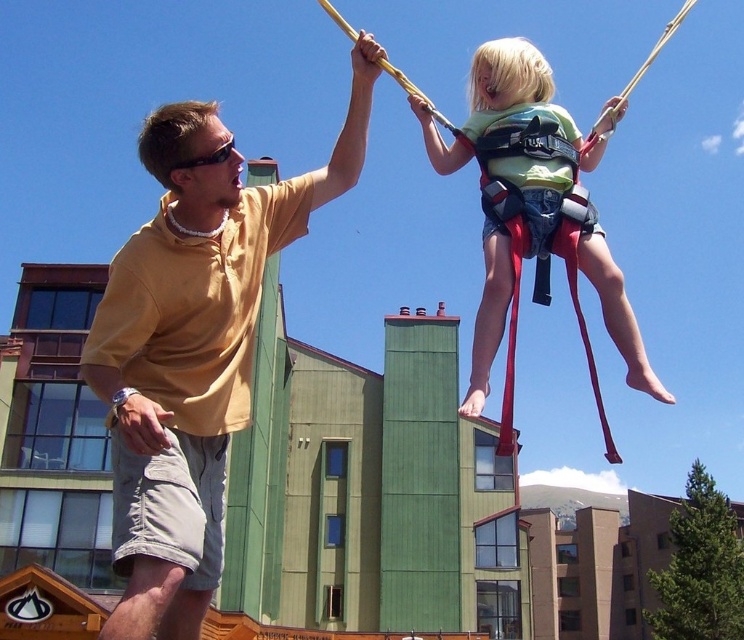
You are a safety inspector checking the bungee setup. The safety regulations state that the distance between the harness and goggles must be less than 10 meters for proper visibility. Are the green fabric harness at upper center and black plastic goggles at upper center compliant with this regulation?

The green fabric harness at upper center is 12.81 meters away from the black plastic goggles at upper center, which exceeds the 10 meters requirement. Therefore, they are not compliant with the safety regulations.

You are designing a safety check system for bungee equipment. You have a camera that can measure object widths. The system needs to ensure that the harness is not wider than the shirt to prevent discomfort. Based on the image, will the green fabric harness at upper center pass the safety check when compared to the matte yellow shirt at center?

The matte yellow shirt at center has a larger width than the green fabric harness at upper center, so the green fabric harness at upper center will pass the safety check since its width is smaller than the shirt.

In the scene shown: You are standing at the camera position and want to reach the point marked as point (182,131). If you walk straight towards it, how far will you have to walk?

The point (182,131) is 56.54 feet away from the camera, so you will have to walk 56.54 feet to reach it.